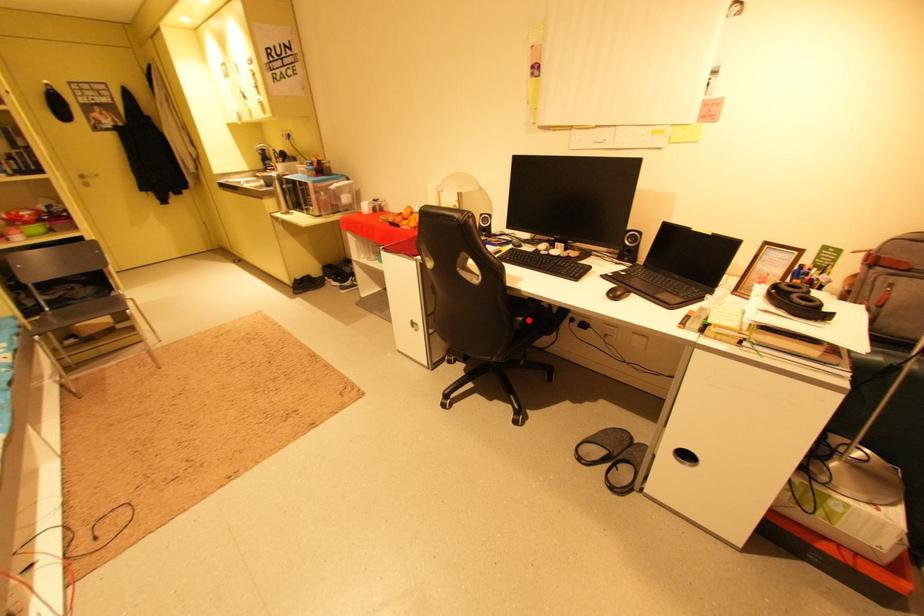
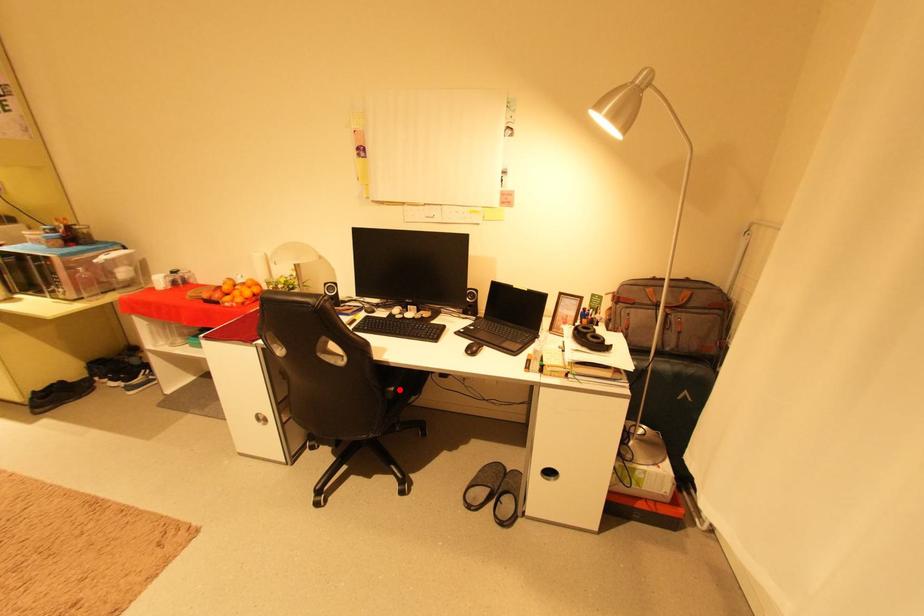
I am providing you with two images of the same scene from different viewpoints. A red point is marked on the first image and another point is marked on the second image. Are the points marked in image1 and image2 representing the same 3D position?

Yes